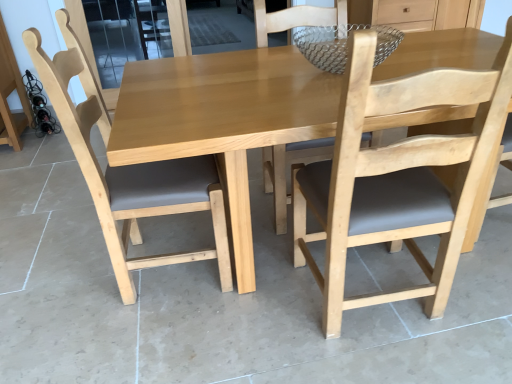
The height and width of the screenshot is (384, 512). What do you see at coordinates (40, 107) in the screenshot? I see `black matte wine bottles at left` at bounding box center [40, 107].

Locate an element on the screen. The image size is (512, 384). natural wood table at center is located at coordinates (223, 119).

What do you see at coordinates (398, 175) in the screenshot? This screenshot has width=512, height=384. I see `light brown wood chair at center, which is the 2th chair from left to right` at bounding box center [398, 175].

Image resolution: width=512 pixels, height=384 pixels. Find the location of `light brown wood chair at center, acting as the 2th chair starting from the right`. light brown wood chair at center, acting as the 2th chair starting from the right is located at coordinates (129, 171).

The image size is (512, 384). Find the location of `black matte wine bottles at left`. black matte wine bottles at left is located at coordinates (40, 107).

In the scene shown: Is light brown wood chair at center, which ranks as the 1th chair in right-to-left order, taller than natural wood table at center?

Yes, light brown wood chair at center, which ranks as the 1th chair in right-to-left order, is taller than natural wood table at center.

Looking at their sizes, would you say light brown wood chair at center, which ranks as the 1th chair in right-to-left order, is wider or thinner than natural wood table at center?

In the image, light brown wood chair at center, which ranks as the 1th chair in right-to-left order, appears to be more narrow than natural wood table at center.

Which is more to the left, light brown wood chair at center, which is the 2th chair from left to right, or natural wood table at center?

From the viewer's perspective, natural wood table at center appears more on the left side.

Would you consider black matte wine bottles at left to be distant from natural wood table at center?

Yes, black matte wine bottles at left and natural wood table at center are located far from each other.

From the picture: Is black matte wine bottles at left oriented towards natural wood table at center?

Yes, black matte wine bottles at left faces towards natural wood table at center.

From the image's perspective, is black matte wine bottles at left above or below natural wood table at center?

black matte wine bottles at left is above natural wood table at center.

From a real-world perspective, which is physically below, light brown wood chair at center, placed as the first chair when sorted from left to right, or natural wood table at center?

natural wood table at center is physically lower.

Between light brown wood chair at center, placed as the first chair when sorted from left to right, and natural wood table at center, which one has larger size?

With larger size is natural wood table at center.

Considering the relative positions of black matte wine bottles at left and light brown wood chair at center, placed as the first chair when sorted from left to right, in the image provided, is black matte wine bottles at left in front of light brown wood chair at center, placed as the first chair when sorted from left to right,?

No, black matte wine bottles at left is behind light brown wood chair at center, placed as the first chair when sorted from left to right.

Which is less distant, [35,108] or [94,84]?

Point [94,84]

Find the location of a particular element. The image size is (512, 384). the 1st chair to the right when counting from the black matte wine bottles at left is located at coordinates (129, 171).

Is black matte wine bottles at left at the right side of light brown wood chair at center, placed as the first chair when sorted from left to right?

No, black matte wine bottles at left is not to the right of light brown wood chair at center, placed as the first chair when sorted from left to right.

Identify the location of kitchen & dining room table lying below the black matte wine bottles at left (from the image's perspective). (223, 119).

From a real-world perspective, is natural wood table at center below black matte wine bottles at left?

No, from a real-world perspective, natural wood table at center is not below black matte wine bottles at left.

Can we say natural wood table at center lies outside black matte wine bottles at left?

Yes, natural wood table at center is located beyond the bounds of black matte wine bottles at left.

Does light brown wood chair at center, placed as the first chair when sorted from left to right, have a greater width compared to black matte wine bottles at left?

Indeed, light brown wood chair at center, placed as the first chair when sorted from left to right, has a greater width compared to black matte wine bottles at left.

From a real-world perspective, is light brown wood chair at center, acting as the 2th chair starting from the right, on black matte wine bottles at left?

Indeed, from a real-world perspective, light brown wood chair at center, acting as the 2th chair starting from the right, stands above black matte wine bottles at left.

In the image, is light brown wood chair at center, placed as the first chair when sorted from left to right, positioned in front of or behind black matte wine bottles at left?

Clearly, light brown wood chair at center, placed as the first chair when sorted from left to right, is in front of black matte wine bottles at left.

Can you tell me how much light brown wood chair at center, acting as the 2th chair starting from the right, and black matte wine bottles at left differ in facing direction?

The facing directions of light brown wood chair at center, acting as the 2th chair starting from the right, and black matte wine bottles at left are 66.7 degrees apart.

From the image's perspective, starting from the black matte wine bottles at left, which chair is the 2nd one below? Please provide its 2D coordinates.

[(398, 175)]

From the image's perspective, is light brown wood chair at center, which is the 2th chair from left to right, below black matte wine bottles at left?

Yes.

Could you tell me if light brown wood chair at center, which is the 2th chair from left to right, is facing black matte wine bottles at left?

No, light brown wood chair at center, which is the 2th chair from left to right, does not turn towards black matte wine bottles at left.

Where is `kitchen & dining room table located behind the light brown wood chair at center, which is the 2th chair from left to right`? kitchen & dining room table located behind the light brown wood chair at center, which is the 2th chair from left to right is located at coordinates click(223, 119).

Find the location of a particular element. kitchen & dining room table located in front of the black matte wine bottles at left is located at coordinates (223, 119).

Based on their spatial positions, is light brown wood chair at center, placed as the first chair when sorted from left to right, or light brown wood chair at center, which is the 2th chair from left to right, further from natural wood table at center?

light brown wood chair at center, placed as the first chair when sorted from left to right.

When comparing their distances from black matte wine bottles at left, does light brown wood chair at center, placed as the first chair when sorted from left to right, or natural wood table at center seem further?

natural wood table at center.

Which object lies further to the anchor point light brown wood chair at center, acting as the 2th chair starting from the right, natural wood table at center or light brown wood chair at center, which ranks as the 1th chair in right-to-left order?

light brown wood chair at center, which ranks as the 1th chair in right-to-left order, is further to light brown wood chair at center, acting as the 2th chair starting from the right.

When comparing their distances from natural wood table at center, does light brown wood chair at center, which ranks as the 1th chair in right-to-left order, or light brown wood chair at center, acting as the 2th chair starting from the right, seem further?

light brown wood chair at center, acting as the 2th chair starting from the right, is positioned further to the anchor natural wood table at center.

Considering their positions, is black matte wine bottles at left positioned closer to light brown wood chair at center, which is the 2th chair from left to right, than natural wood table at center?

Based on the image, natural wood table at center appears to be nearer to light brown wood chair at center, which is the 2th chair from left to right.

Which object lies nearer to the anchor point black matte wine bottles at left, light brown wood chair at center, placed as the first chair when sorted from left to right, or light brown wood chair at center, which is the 2th chair from left to right?

light brown wood chair at center, placed as the first chair when sorted from left to right, is closer to black matte wine bottles at left.

When comparing their distances from black matte wine bottles at left, does natural wood table at center or light brown wood chair at center, which ranks as the 1th chair in right-to-left order, seem further?

Among the two, light brown wood chair at center, which ranks as the 1th chair in right-to-left order, is located further to black matte wine bottles at left.

Estimate the real-world distances between objects in this image. Which object is further from light brown wood chair at center, which ranks as the 1th chair in right-to-left order, black matte wine bottles at left or light brown wood chair at center, placed as the first chair when sorted from left to right?

black matte wine bottles at left.

At what (x,y) coordinates should I click in order to perform the action: click on chair located between natural wood table at center and black matte wine bottles at left in the depth direction. Please return your answer as a coordinate pair (x, y). This screenshot has width=512, height=384. Looking at the image, I should click on (129, 171).

Locate an element on the screen. kitchen & dining room table situated between black matte wine bottles at left and light brown wood chair at center, which is the 2th chair from left to right, from left to right is located at coordinates (223, 119).

Where is `kitchen & dining room table located between light brown wood chair at center, acting as the 2th chair starting from the right, and light brown wood chair at center, which is the 2th chair from left to right, in the left-right direction`? kitchen & dining room table located between light brown wood chair at center, acting as the 2th chair starting from the right, and light brown wood chair at center, which is the 2th chair from left to right, in the left-right direction is located at coordinates (223, 119).

The height and width of the screenshot is (384, 512). I want to click on chair between light brown wood chair at center, which is the 2th chair from left to right, and black matte wine bottles at left, along the z-axis, so click(129, 171).